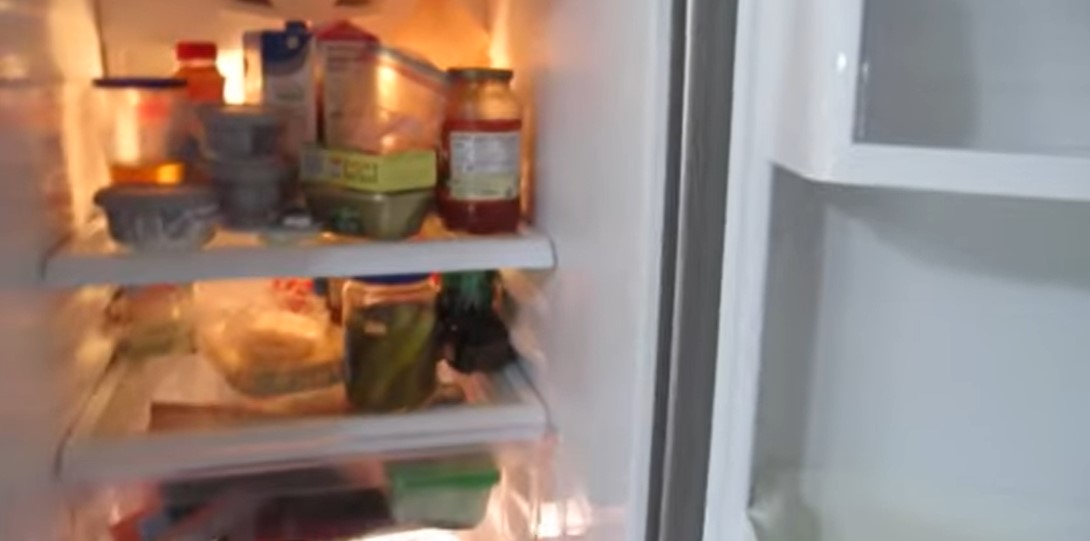
You are a GUI agent. You are given a task and a screenshot of the screen. Output one action in this format:
    pyautogui.click(x=<x>, y=<y>)
    Task: Click on the fridge light
    The width and height of the screenshot is (1090, 541).
    Given the screenshot: What is the action you would take?
    pyautogui.click(x=234, y=81)